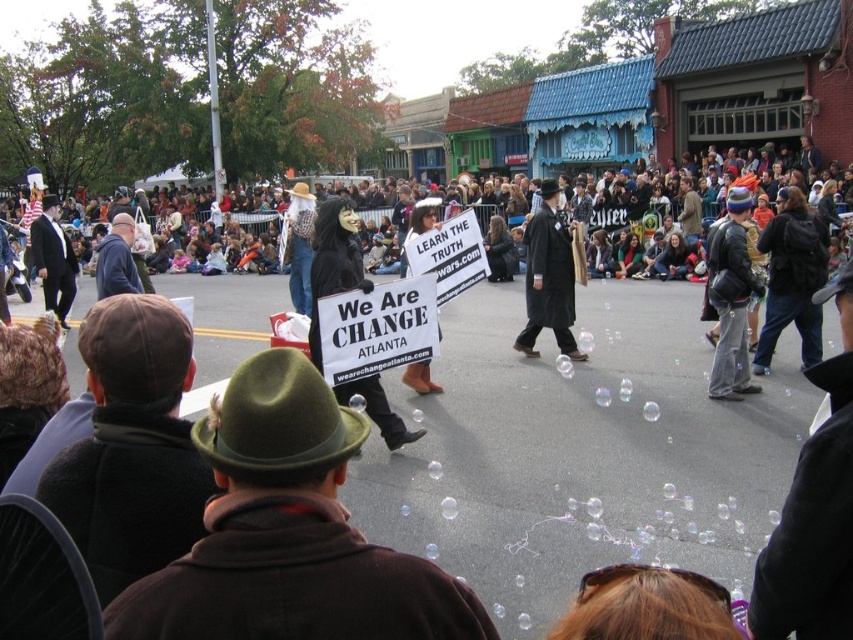
You are a photographer trying to capture the entire scene of the event. You notice the dark brown leather jacket at upper center and the white paper sign at center. Which object should you focus on to ensure both are visible in your frame without cropping?

The dark brown leather jacket at upper center is larger in size than the white paper sign at center, so focusing on the dark brown leather jacket at upper center would ensure both are visible in the frame without cropping.

You are a photographer positioned at the edge of the crowd. You want to take a photo of both the black matte mask at center and the black wool coat at center. Which object should you focus on first to ensure both are in sharp focus?

The black matte mask at center is closer to the viewer than the black wool coat at center. To ensure both are in sharp focus, you should focus on the black matte mask at center first, as it is the closer object. This will maximize the depth of field, allowing the black wool coat at center to also be in focus.